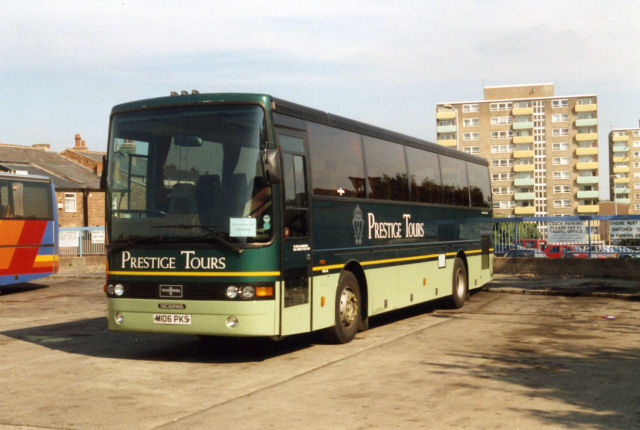
Where is `window`? This screenshot has height=430, width=640. window is located at coordinates 564,162.